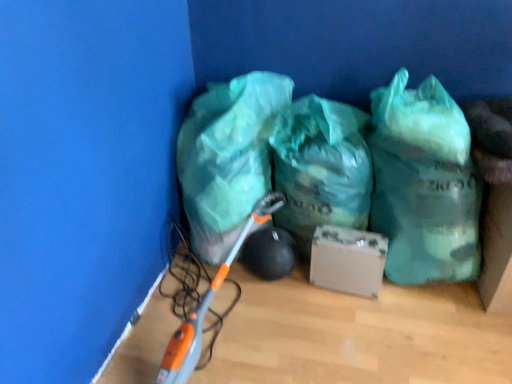
You are a GUI agent. You are given a task and a screenshot of the screen. Output one action in this format:
    pyautogui.click(x=<x>, y=<y>)
    Task: Click on the vacant space to the left of matte cardboard box at center
    The image size is (512, 384).
    Given the screenshot: What is the action you would take?
    pyautogui.click(x=295, y=302)